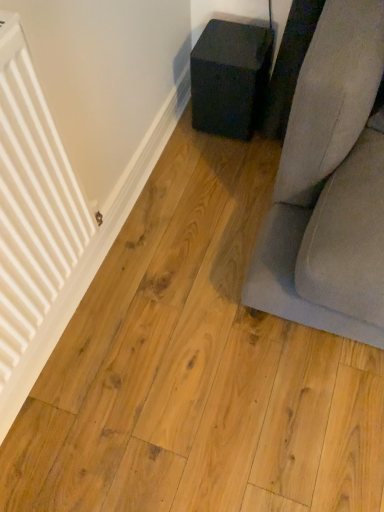
At what (x,y) coordinates should I click in order to perform the action: click on vacant point above matte black cube at center (from a real-world perspective). Please return your answer as a coordinate pair (x, y). Looking at the image, I should click on (230, 40).